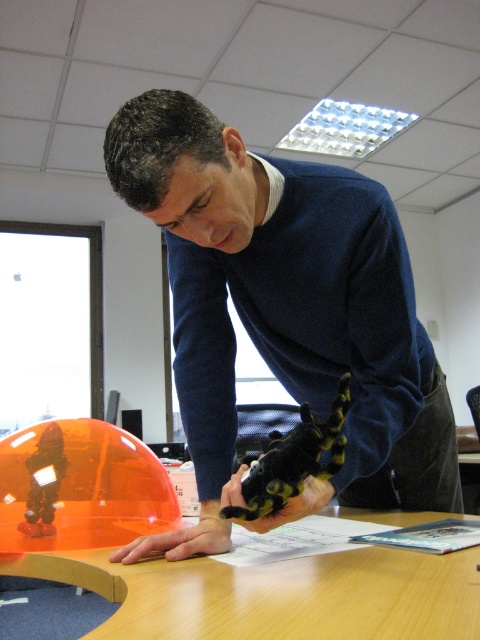
Question: Which point is closer to the camera taking this photo?

Choices:
 (A) (321, 488)
 (B) (223, 552)
 (C) (271, 461)
 (D) (301, 314)

Answer: (C)

Question: Does black fuzzy toy at center appear over black fuzzy glove at lower center?

Choices:
 (A) no
 (B) yes

Answer: (B)

Question: Which point is closer to the camera?

Choices:
 (A) (122, 547)
 (B) (314, 483)
 (C) (346, 496)
 (D) (275, 508)

Answer: (D)

Question: Can you confirm if blue matte sweater at center is positioned to the left of smooth skin hand at center?

Choices:
 (A) no
 (B) yes

Answer: (A)

Question: Estimate the real-world distances between objects in this image. Which object is closer to the black fuzzy glove at lower center?

Choices:
 (A) blue matte sweater at center
 (B) glossy plastic table at center
 (C) smooth skin hand at center

Answer: (C)

Question: In this image, where is glossy plastic table at center located relative to black fuzzy toy at center?

Choices:
 (A) left
 (B) right

Answer: (A)